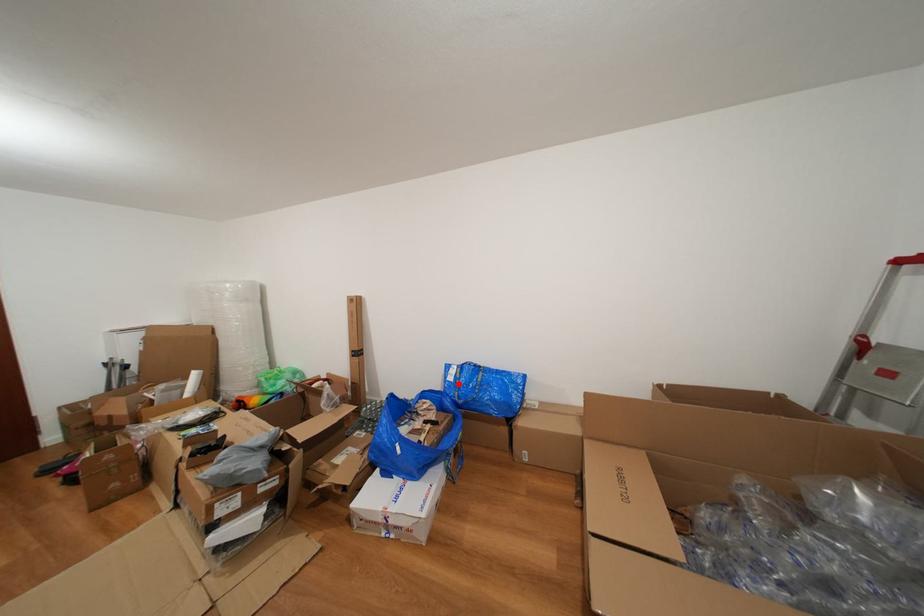
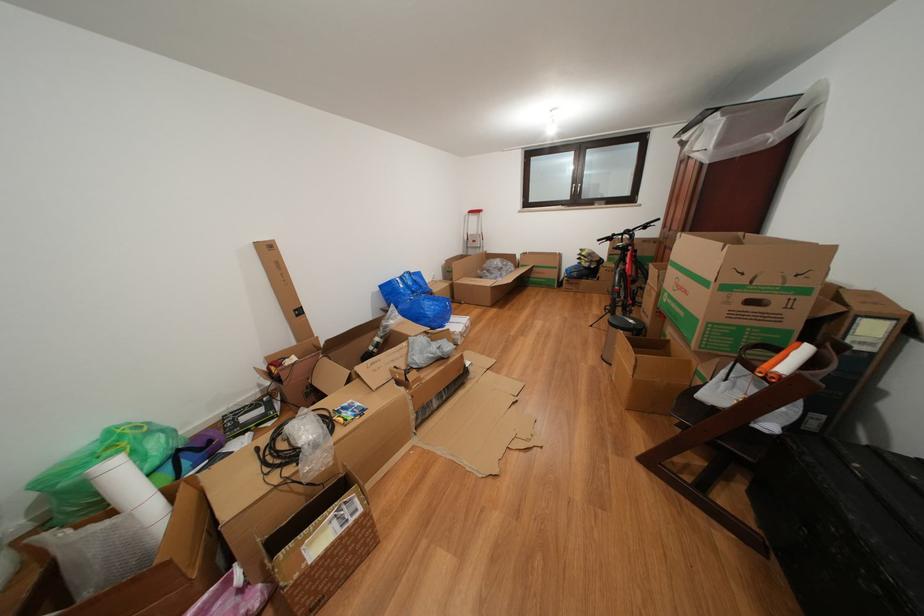
Question: I am providing you with two images of the same scene from different viewpoints. In image1, a red point is highlighted. Considering the same 3D point in image2, which of the following is correct?

Choices:
 (A) It is closer
 (B) It is farther

Answer: (A)